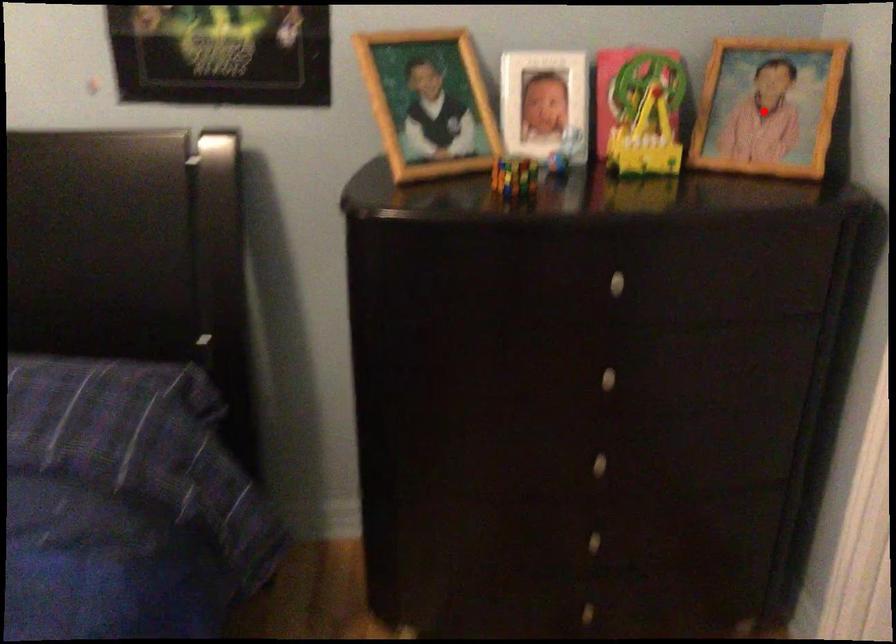
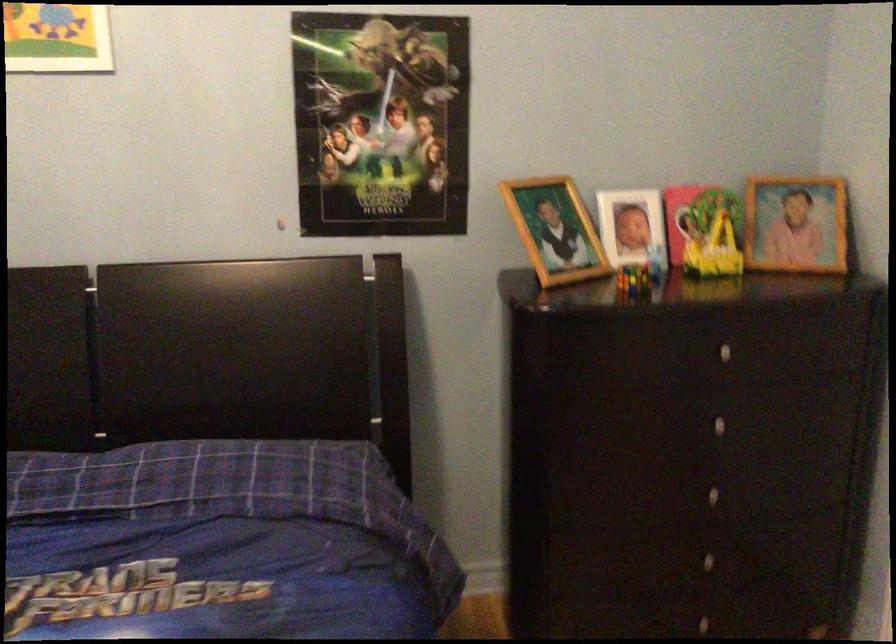
Question: A red point is marked in image1. In image2, is the corresponding 3D point closer to the camera or farther? Reply with the corresponding letter.

Choices:
 (A) The corresponding 3D point is closer.
 (B) The corresponding 3D point is farther.

Answer: (B)